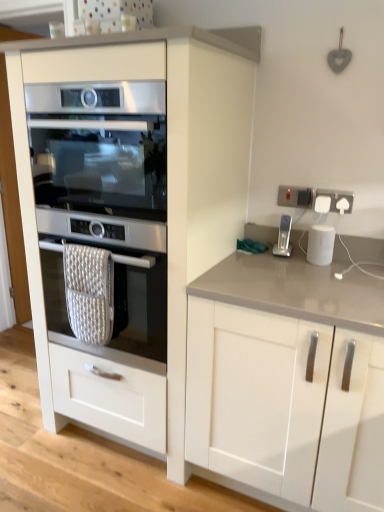
Question: Is point (289, 229) closer or farther from the camera than point (236, 77)?

Choices:
 (A) farther
 (B) closer

Answer: (A)

Question: Would you say silver metallic stapler at right is to the left or to the right of white glossy cabinet at left, which ranks as the first cabinetry in left-to-right order, in the picture?

Choices:
 (A) right
 (B) left

Answer: (A)

Question: Estimate the real-world distances between objects in this image. Which object is farther from the white glossy cabinet at left, which ranks as the first cabinetry in left-to-right order?

Choices:
 (A) white glossy smart speaker at right
 (B) white plastic socket at upper right, the 1th electric outlet viewed from the left
 (C) satin silver oven at center, which is the first oven from bottom to top
 (D) white glossy cabinet at lower right, marked as the 1th cabinetry in a right-to-left arrangement
 (E) silver metallic stapler at right

Answer: (A)

Question: Which object is the farthest from the white glossy smart speaker at right?

Choices:
 (A) white glossy cabinet at lower right, the second cabinetry in the left-to-right sequence
 (B) white glossy cabinet at left, which ranks as the first cabinetry in left-to-right order
 (C) satin silver oven at center, the first oven viewed from the top
 (D) silver metallic stapler at right
 (E) white plastic socket at upper right, the 1th electric outlet viewed from the left

Answer: (C)